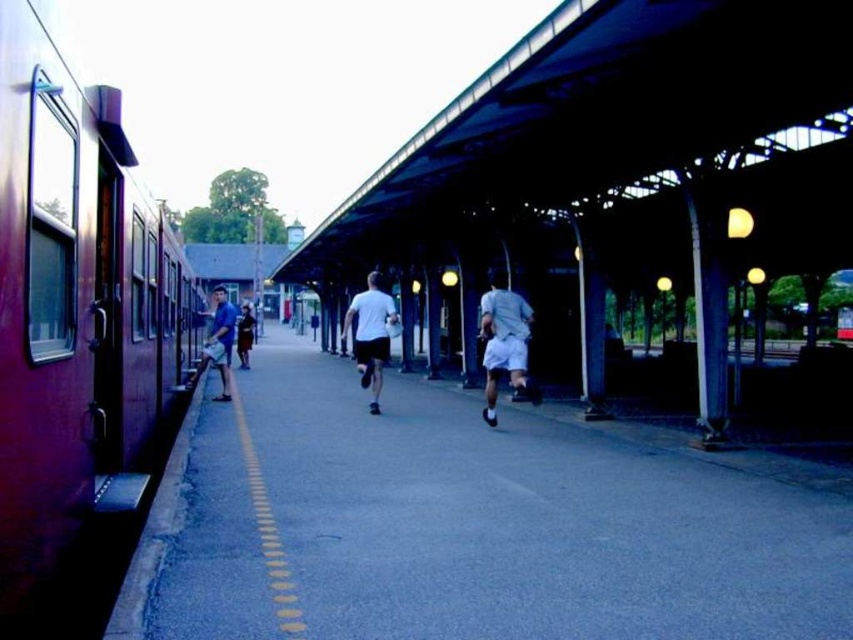
Can you confirm if metallic red train at left is positioned below white matte shirt at center?

No.

Does metallic red train at left have a lesser height compared to white matte shirt at center?

Incorrect, metallic red train at left's height does not fall short of white matte shirt at center's.

What are the coordinates of `metallic red train at left` in the screenshot? It's located at (77, 337).

Which of these two, metallic red train at left or blue cotton shirt at left, stands shorter?

With less height is metallic red train at left.

Can you confirm if metallic red train at left is positioned to the right of blue cotton shirt at left?

Correct, you'll find metallic red train at left to the right of blue cotton shirt at left.

Which is behind, point (167, 369) or point (216, 296)?

The point (216, 296) is more distant.

At what (x,y) coordinates should I click in order to perform the action: click on metallic red train at left. Please return your answer as a coordinate pair (x, y). The width and height of the screenshot is (853, 640). Looking at the image, I should click on (77, 337).

Between point (223, 340) and point (242, 312), which one is positioned in front?

Positioned in front is point (223, 340).

Can you confirm if blue cotton shirt at left is taller than dark blue jeans at center?

Correct, blue cotton shirt at left is much taller as dark blue jeans at center.

Is point (222, 346) farther from camera compared to point (239, 342)?

No, (222, 346) is in front of (239, 342).

I want to click on blue cotton shirt at left, so click(221, 339).